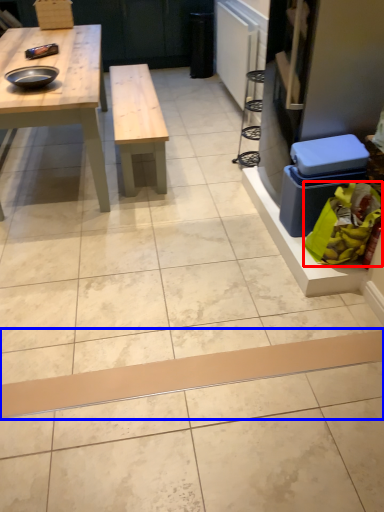
Question: Which object appears closest to the camera in this image, food (highlighted by a red box) or plank (highlighted by a blue box)?

Choices:
 (A) food
 (B) plank

Answer: (B)